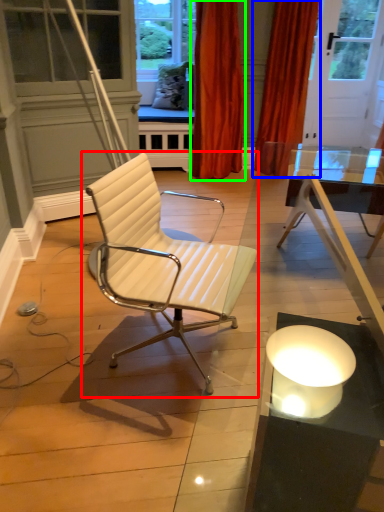
Question: Considering the real-world distances, which object is closest to chair (highlighted by a red box)? curtain (highlighted by a blue box) or curtain (highlighted by a green box).

Choices:
 (A) curtain
 (B) curtain

Answer: (B)